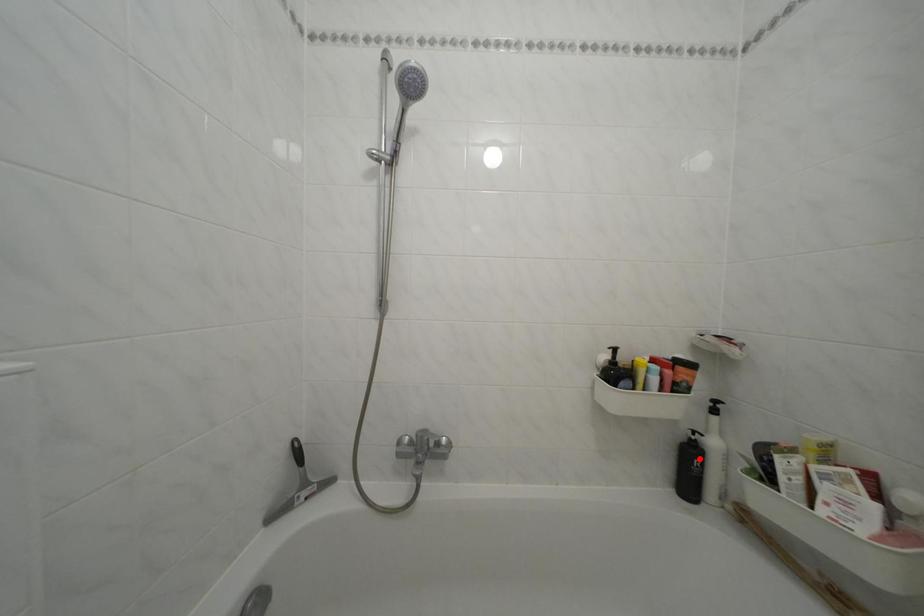
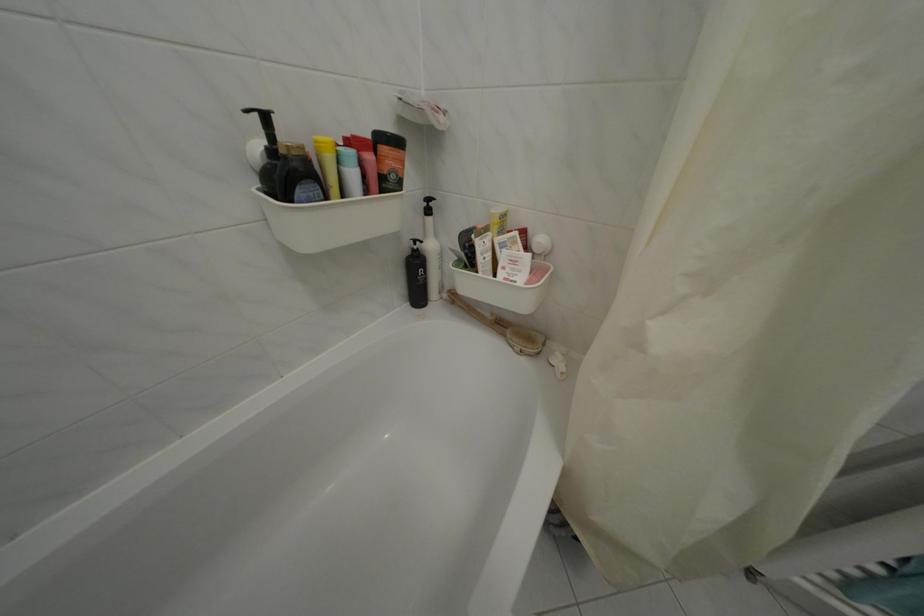
Find the pixel in the second image that matches the highlighted location in the first image.

(424, 269)